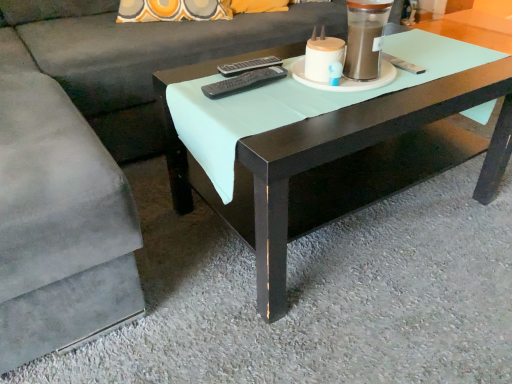
Question: Which direction should I rotate to look at black plastic remote at center, marked as the first remote in a front-to-back arrangement, — up or down?

Choices:
 (A) up
 (B) down

Answer: (A)

Question: Are black plastic remote at center, which is the 1th remote in back-to-front order, and matte black coffee table at center beside each other?

Choices:
 (A) yes
 (B) no

Answer: (B)

Question: Can you confirm if black plastic remote at center, the 2th remote viewed from the front, is thinner than matte black coffee table at center?

Choices:
 (A) no
 (B) yes

Answer: (B)

Question: From the image's perspective, is black plastic remote at center, the 2th remote viewed from the front, located beneath matte black coffee table at center?

Choices:
 (A) yes
 (B) no

Answer: (B)

Question: Is black plastic remote at center, the 2th remote viewed from the front, turned away from matte black coffee table at center?

Choices:
 (A) no
 (B) yes

Answer: (A)

Question: Can you confirm if black plastic remote at center, which is the 1th remote in back-to-front order, is positioned to the left of matte black coffee table at center?

Choices:
 (A) yes
 (B) no

Answer: (A)

Question: Is black plastic remote at center, which is the 1th remote in back-to-front order, at the right side of matte black coffee table at center?

Choices:
 (A) yes
 (B) no

Answer: (B)

Question: Can you confirm if matte white candle holder at upper center is positioned to the left of black plastic remote at center, marked as the first remote in a front-to-back arrangement?

Choices:
 (A) yes
 (B) no

Answer: (B)

Question: Is matte white candle holder at upper center in front of black plastic remote at center, marked as the first remote in a front-to-back arrangement?

Choices:
 (A) yes
 (B) no

Answer: (A)

Question: Is matte white candle holder at upper center smaller than black plastic remote at center, the 2th remote viewed from the back?

Choices:
 (A) no
 (B) yes

Answer: (A)

Question: Is matte white candle holder at upper center outside black plastic remote at center, marked as the first remote in a front-to-back arrangement?

Choices:
 (A) yes
 (B) no

Answer: (A)

Question: Are matte white candle holder at upper center and black plastic remote at center, the 2th remote viewed from the back, beside each other?

Choices:
 (A) yes
 (B) no

Answer: (B)

Question: Is matte white candle holder at upper center aimed at black plastic remote at center, the 2th remote viewed from the back?

Choices:
 (A) no
 (B) yes

Answer: (A)

Question: Considering the relative sizes of black plastic remote at center, the 2th remote viewed from the back, and black plastic remote at center, the 2th remote viewed from the front, in the image provided, is black plastic remote at center, the 2th remote viewed from the back, taller than black plastic remote at center, the 2th remote viewed from the front,?

Choices:
 (A) no
 (B) yes

Answer: (B)